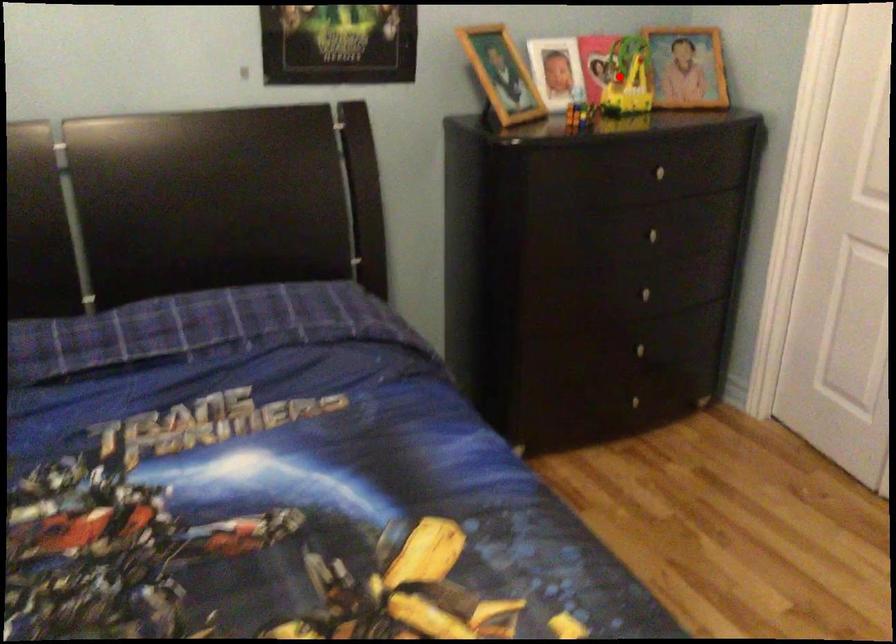
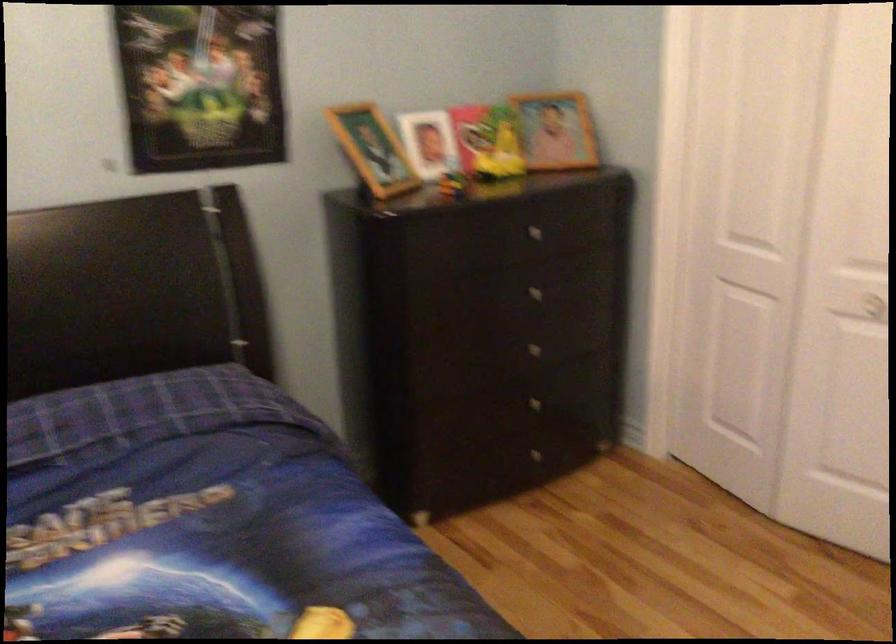
In the second image, find the point that corresponds to the highlighted location in the first image.

(487, 142)